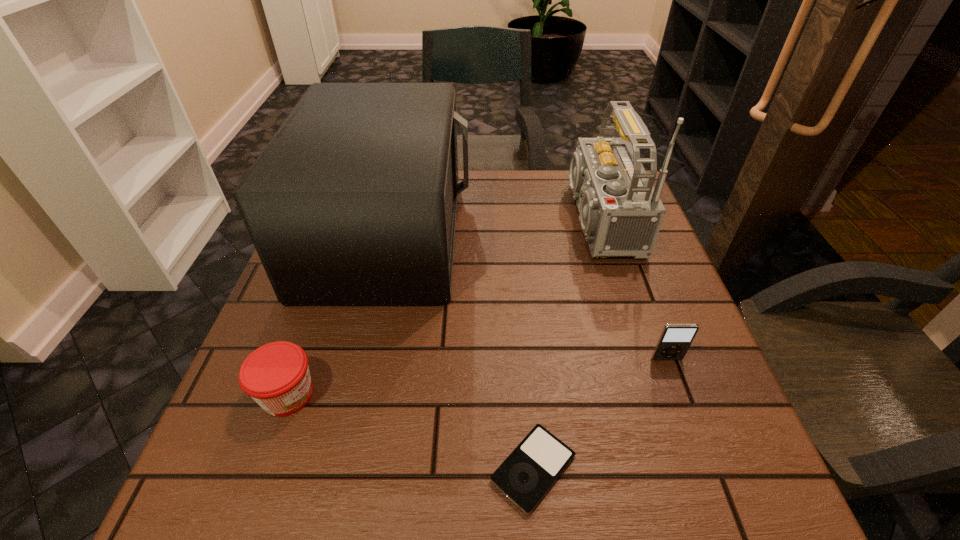
In order to click on free space located 0.360m on the front-facing side of the microwave oven in this screenshot , I will do `click(613, 234)`.

You are a GUI agent. You are given a task and a screenshot of the screen. Output one action in this format:
    pyautogui.click(x=<x>, y=<y>)
    Task: Click on the vacant space located 0.220m on the front-facing side of the right iPod
    Image resolution: width=960 pixels, height=540 pixels.
    Given the screenshot: What is the action you would take?
    (x=711, y=482)

The image size is (960, 540). What are the coordinates of `free space located on the label side of the second nearest object` in the screenshot? It's located at (393, 395).

I want to click on vacant space located on the back of the third object from left to right, so coord(524,357).

This screenshot has width=960, height=540. Identify the location of radio receiver that is at the far edge. (621, 213).

This screenshot has height=540, width=960. I want to click on microwave oven that is at the far edge, so click(x=353, y=202).

Locate an element on the screen. This screenshot has width=960, height=540. object at the near edge is located at coordinates (526, 475).

Locate an element on the screen. microwave oven present at the left edge is located at coordinates [353, 202].

Identify the location of jam that is positioned at the left edge. (276, 375).

This screenshot has width=960, height=540. What are the coordinates of `radio receiver that is at the right edge` in the screenshot? It's located at (621, 213).